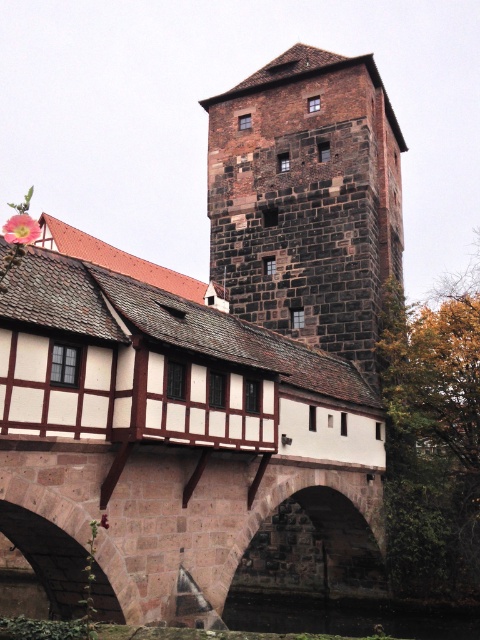
You are an architect examining a historic site. You observe the dark brown stone tower at upper center and the brown stone bridge at center. Which structure is positioned higher in the image?

The dark brown stone tower at upper center is positioned higher than the brown stone bridge at center in the image.

In the scene shown: You are an architect designing a new bridge and want to ensure the tower and river are proportionate. Given the dark brown stone tower at upper center and the black stone river at lower center, which one is wider?

The dark brown stone tower at upper center is wider than the black stone river at lower center.

You are an architect visiting a historic site and see the dark brown stone tower at upper center and the brown stone bridge at center. Which structure would require more construction materials based on their sizes?

The dark brown stone tower at upper center is larger in size than the brown stone bridge at center, so it would require more construction materials.